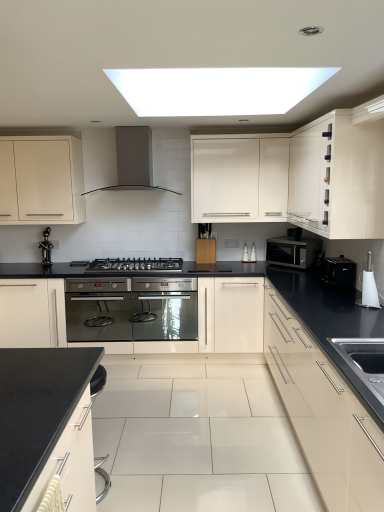
Where is `vacant area to the left of white glossy toilet brush at right, positioned as the 1th appliance in front-to-back order`? vacant area to the left of white glossy toilet brush at right, positioned as the 1th appliance in front-to-back order is located at coordinates (342, 304).